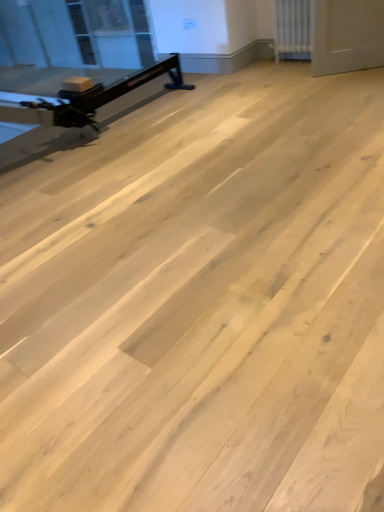
Question: Can you confirm if transparent glass window screen at upper left is shorter than white textured radiator at upper right?

Choices:
 (A) no
 (B) yes

Answer: (A)

Question: Is transparent glass window screen at upper left oriented away from white textured radiator at upper right?

Choices:
 (A) yes
 (B) no

Answer: (B)

Question: Considering the relative positions of transparent glass window screen at upper left and white textured radiator at upper right in the image provided, is transparent glass window screen at upper left to the left of white textured radiator at upper right from the viewer's perspective?

Choices:
 (A) yes
 (B) no

Answer: (A)

Question: Does transparent glass window screen at upper left have a smaller size compared to white textured radiator at upper right?

Choices:
 (A) yes
 (B) no

Answer: (B)

Question: Is transparent glass window screen at upper left next to white textured radiator at upper right and touching it?

Choices:
 (A) no
 (B) yes

Answer: (A)

Question: Is transparent glass window screen at upper left to the right of white textured radiator at upper right from the viewer's perspective?

Choices:
 (A) no
 (B) yes

Answer: (A)

Question: Is white textured radiator at upper right thinner than matte black exercise bike at left?

Choices:
 (A) no
 (B) yes

Answer: (A)

Question: Can you confirm if white textured radiator at upper right is positioned to the right of matte black exercise bike at left?

Choices:
 (A) no
 (B) yes

Answer: (B)

Question: Can you confirm if white textured radiator at upper right is taller than matte black exercise bike at left?

Choices:
 (A) no
 (B) yes

Answer: (A)

Question: Does white textured radiator at upper right contain matte black exercise bike at left?

Choices:
 (A) yes
 (B) no

Answer: (B)

Question: Would you consider white textured radiator at upper right to be distant from matte black exercise bike at left?

Choices:
 (A) no
 (B) yes

Answer: (B)

Question: Is white textured radiator at upper right not within matte black exercise bike at left?

Choices:
 (A) yes
 (B) no

Answer: (A)

Question: From the image's perspective, does white textured radiator at upper right appear lower than transparent glass window screen at upper left?

Choices:
 (A) yes
 (B) no

Answer: (A)